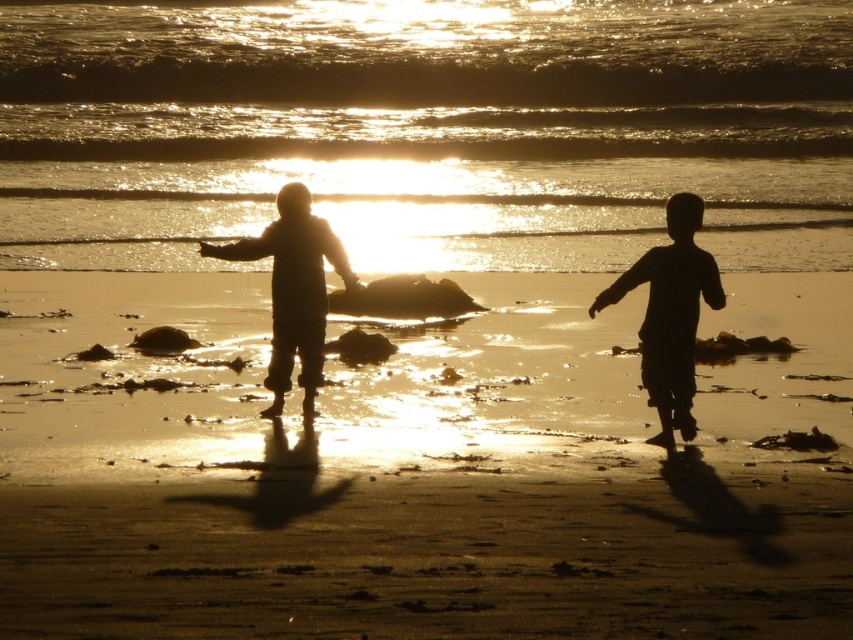
You are standing on the beach looking at the sunset. There are two points marked in the scene. The first point is at coordinates point (x=62, y=404) and the second is at point (x=167, y=202). Which point is closer to you?

Point (x=62, y=404) is closer to the viewer than point (x=167, y=202).

You are standing at the point marked as point (68, 492) and want to reach a seashell located 41.28 feet away. Can you walk straight to it without encountering any obstacles?

The point (68, 492) is 41.28 feet away from the seashell. Since the beach is sandy with scattered rocks and debris, there might be obstacles in your path. You should check the area for rocks or debris before walking straight to the seashell.

You are standing at the origin of the coordinate system in the beach scene. There are two points marked on the sand, point A at point [358,60] and point B at point [352,296]. If you want to walk towards the sea, which point should you pass through first?

Point B at point [352,296] should be passed through first because point A at point [358,60] is behind it.